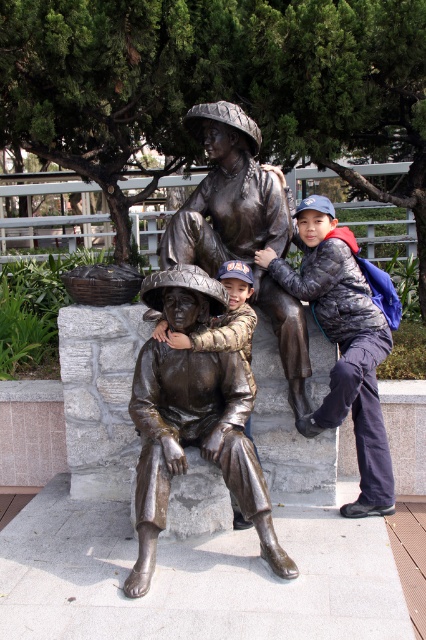
Can you confirm if bronze statue at center is wider than bronze statue of child at center?

Yes.

Which of these two, bronze statue at center or bronze statue of child at center, stands shorter?

With less height is bronze statue of child at center.

Where is `bronze statue at center`? The height and width of the screenshot is (640, 426). bronze statue at center is located at coordinates (193, 444).

Image resolution: width=426 pixels, height=640 pixels. I want to click on bronze statue at center, so click(193, 444).

Is bronze statue at center taller than dark gray quilted jacket at right?

In fact, bronze statue at center may be shorter than dark gray quilted jacket at right.

Which of these two, bronze statue at center or dark gray quilted jacket at right, stands taller?

With more height is dark gray quilted jacket at right.

Between point (229, 355) and point (371, 502), which one is positioned in front?

Point (229, 355) is more forward.

I want to click on bronze statue at center, so click(193, 444).

Does bronze statue at center have a greater width compared to bronze statue of family at center?

Incorrect, bronze statue at center's width does not surpass bronze statue of family at center's.

Measure the distance between point (143, 464) and camera.

3.16 meters

In order to click on bronze statue at center in this screenshot , I will do `click(193, 444)`.